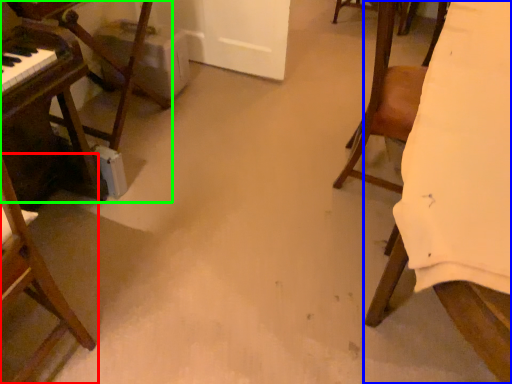
Question: Which object is the closest to the chair (highlighted by a red box)? Choose among these: furniture (highlighted by a blue box) or furniture (highlighted by a green box).

Choices:
 (A) furniture
 (B) furniture

Answer: (B)